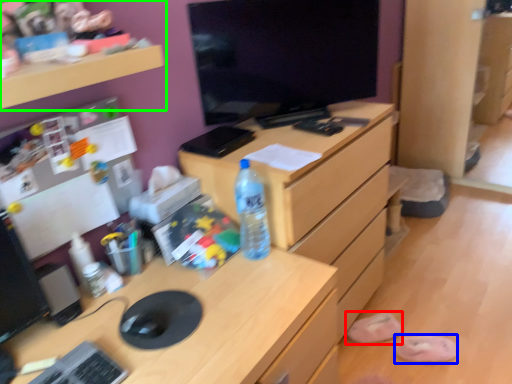
Question: Which is farther away from slipper (highlighted by a red box)? slipper (highlighted by a blue box) or shelf (highlighted by a green box)?

Choices:
 (A) slipper
 (B) shelf

Answer: (B)